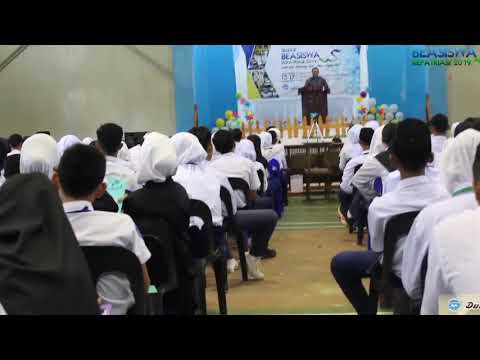
At what (x,y) coordinates should I click in order to perform the action: click on chairs. Please return your answer as a coordinate pair (x, y). The height and width of the screenshot is (360, 480). Looking at the image, I should click on pos(105,262), pos(168,237), pos(400,230).